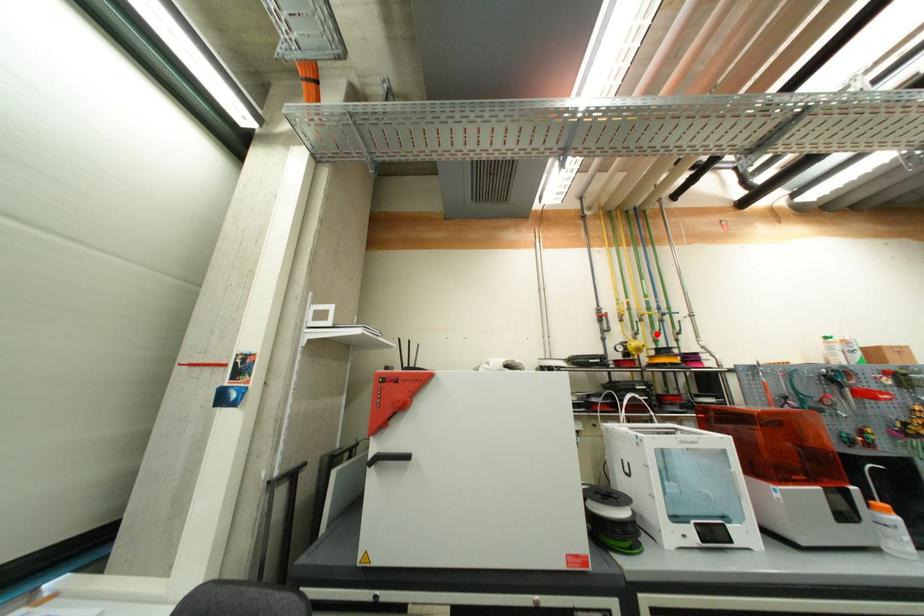
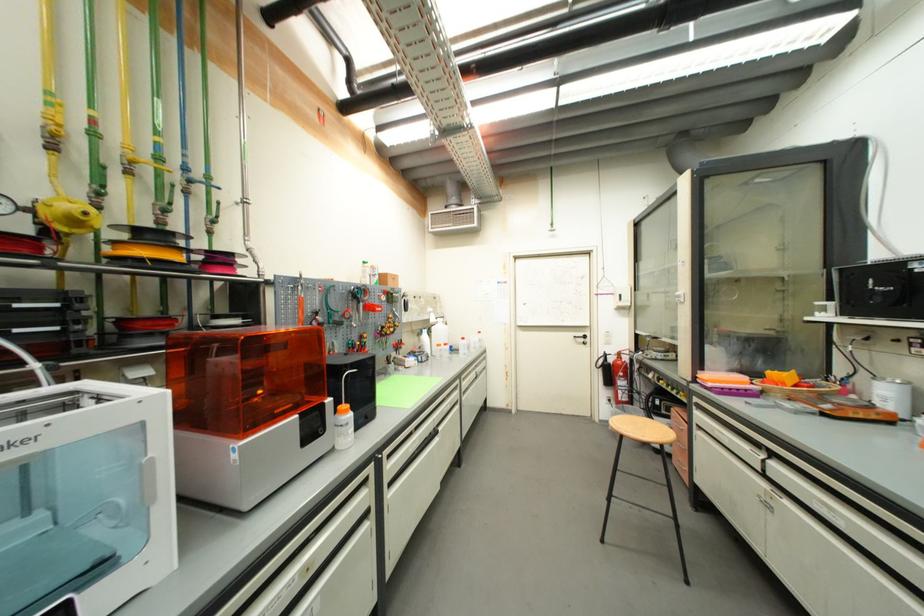
In the second image, find the point that corresponds to the highlighted location in the first image.

(160, 207)